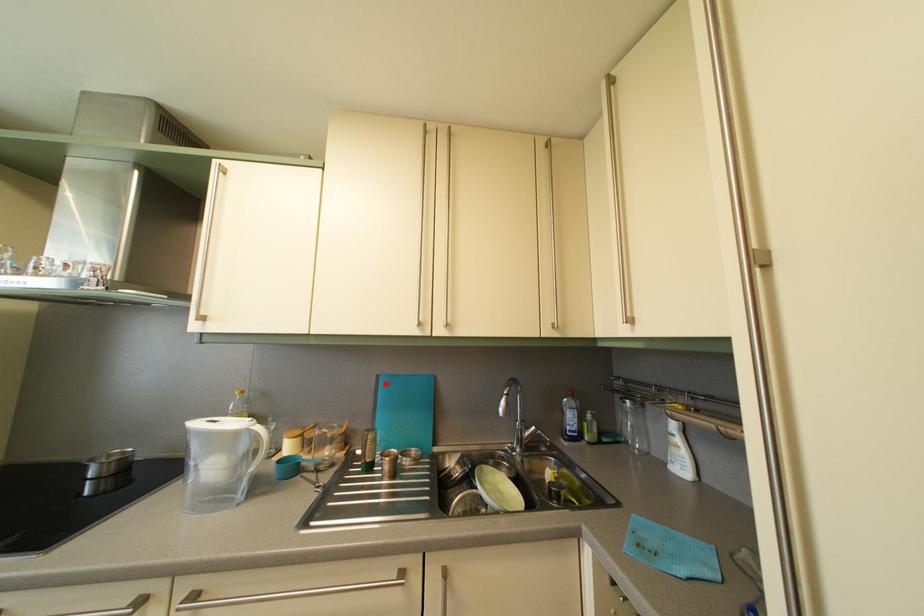
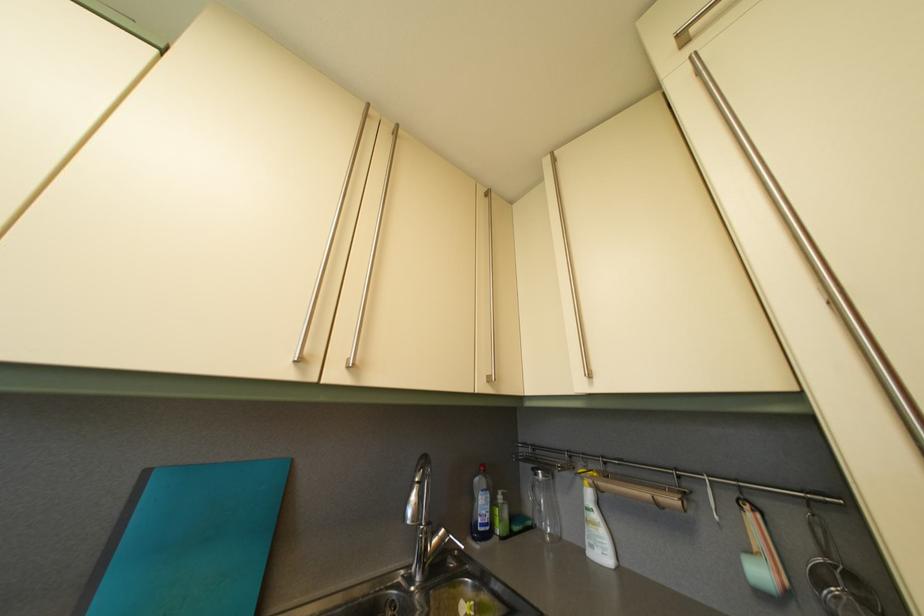
Question: I am providing you with two images of the same scene from different viewpoints. A red point is marked on the first image. Is the red point's position out of view in image 2?

Choices:
 (A) Yes
 (B) No

Answer: (B)